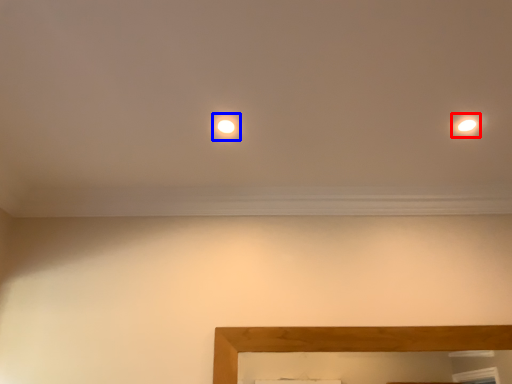
Question: Which point is closer to the camera, light (highlighted by a red box) or glow (highlighted by a blue box)?

Choices:
 (A) light
 (B) glow

Answer: (A)